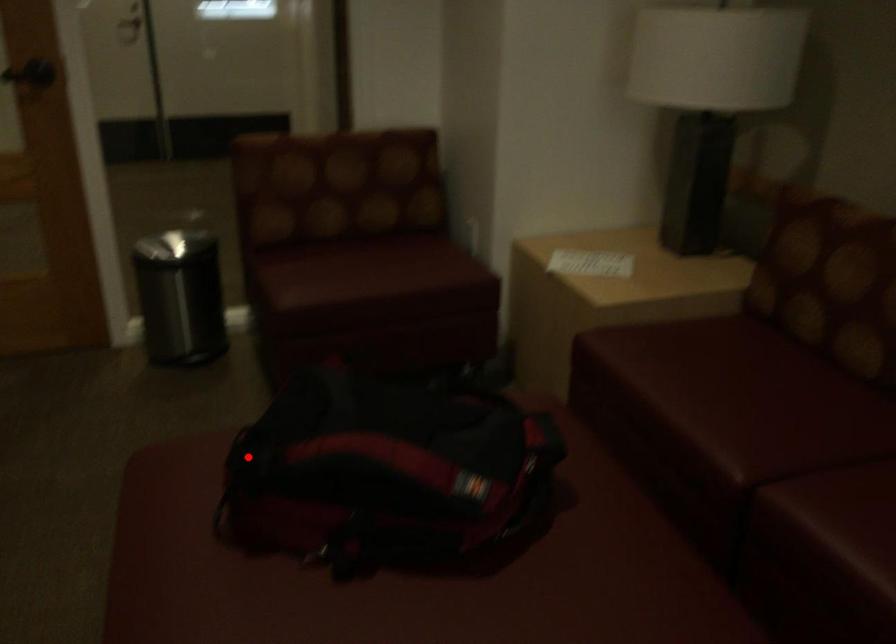
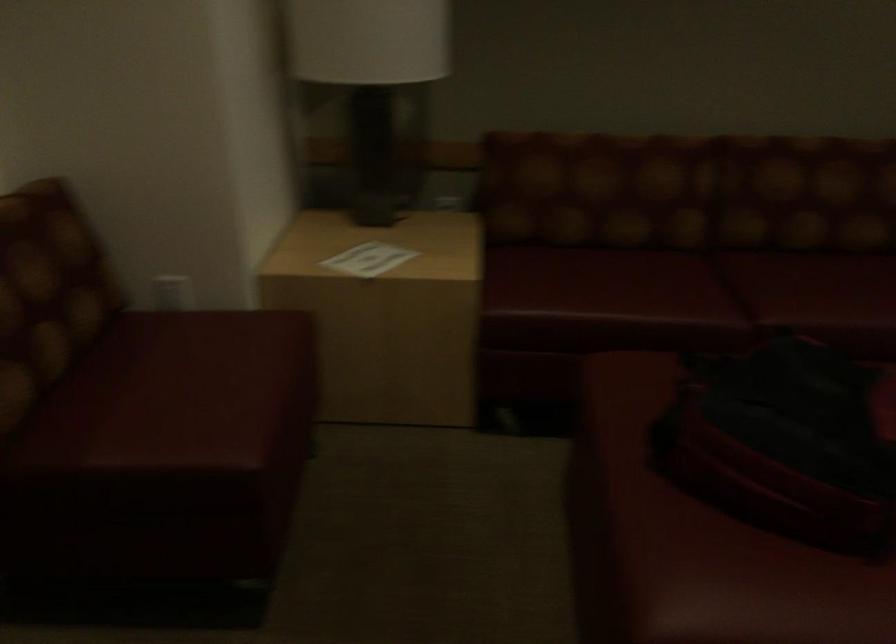
The point at the highlighted location is marked in the first image. Where is the corresponding point in the second image?

(693, 541)